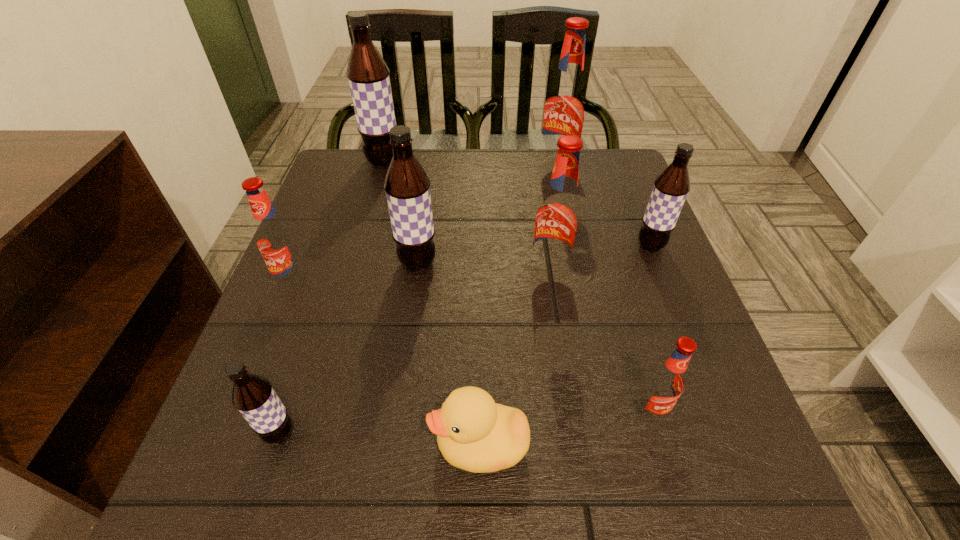
The width and height of the screenshot is (960, 540). I want to click on the biggest brown root beer, so click(x=368, y=75).

Where is `the biggest red root beer`? This screenshot has height=540, width=960. the biggest red root beer is located at coordinates (565, 107).

Locate an element on the screen. the second biggest brown root beer is located at coordinates (407, 186).

Where is `the third brown root beer from left to right`? the third brown root beer from left to right is located at coordinates (407, 186).

Find the location of a particular element. the third smallest red root beer is located at coordinates (558, 218).

Identify the location of the leftmost red root beer. (x=274, y=237).

This screenshot has width=960, height=540. Find the location of `the second smallest red root beer`. the second smallest red root beer is located at coordinates (274, 237).

In order to click on the rightmost brown root beer in this screenshot , I will do `click(671, 187)`.

Where is `the rightmost object`? The height and width of the screenshot is (540, 960). the rightmost object is located at coordinates (671, 187).

Find the location of a particular element. The image size is (960, 540). the smallest red root beer is located at coordinates (665, 383).